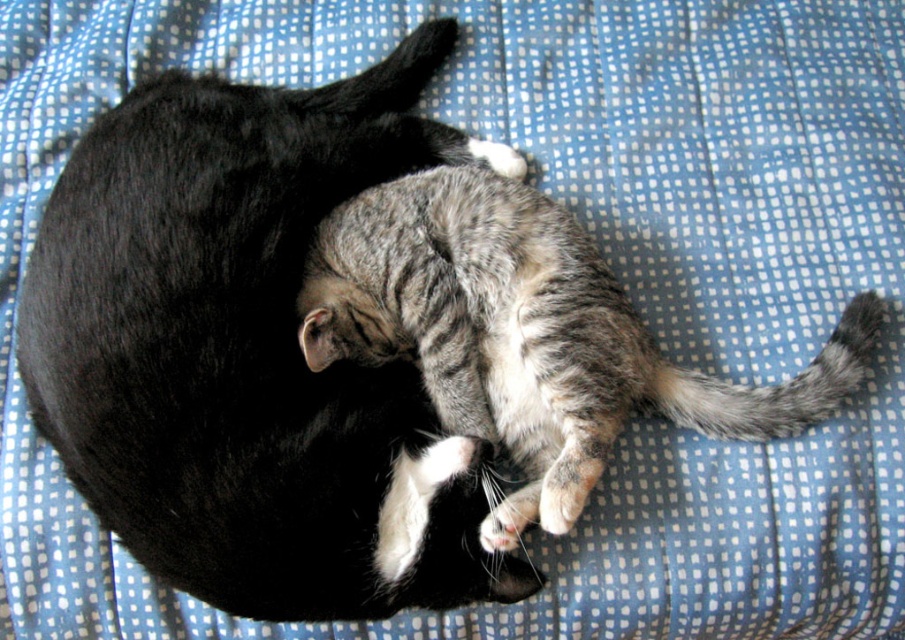
You are a photographer trying to capture a closeup of the gray striped fur cat at center. You want to ensure the soft fur cat at center is not in the background. Which direction should you move your camera to achieve this?

To avoid having the soft fur cat at center in the background when focusing on the gray striped fur cat at center, you should move your camera to the right. Since the soft fur cat at center is to the left of the gray striped fur cat at center, moving the camera to the right will shift the frame away from the soft fur cat at center, keeping it out of the shot.

You are a photographer standing 5 feet away from the soft fur cat at center. You want to take a closeup photo of it. Can you move closer to the cat to get a better shot without exceeding the minimum safe distance?

The soft fur cat at center is 3.76 feet away from the viewer. Since you are already 5 feet away, you can move 1.24 feet closer to reach the minimum safe distance of 3.76 feet and take the closeup photo.

You are a photographer wanting to capture a clear photo of both the soft fur cat at center and the gray striped fur cat at center. Since the cats are close together, you need to adjust your camera focus. Which cat should you focus on to ensure the taller one is in focus?

The soft fur cat at center is taller than the gray striped fur cat at center, so you should focus on the soft fur cat at center to ensure the taller one is in focus.